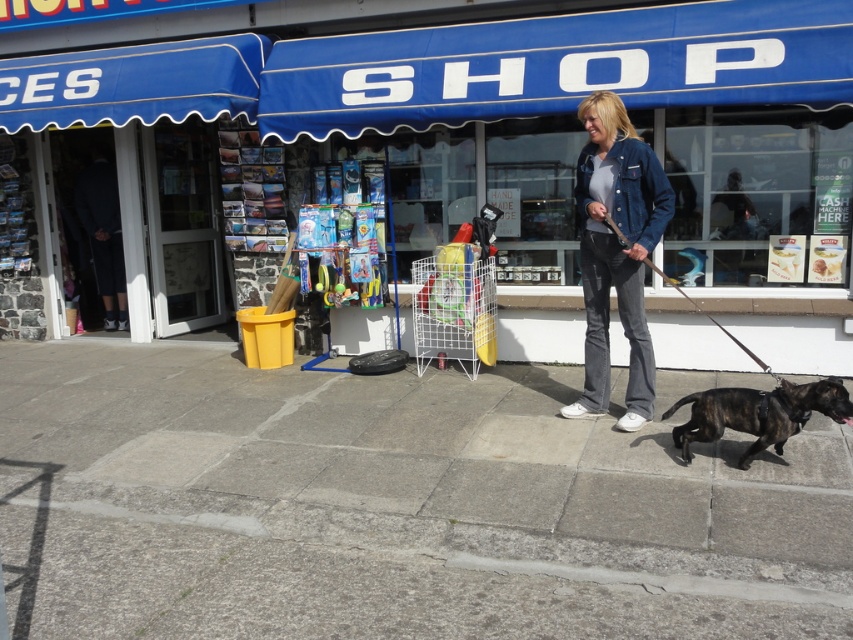
You are a delivery person who needs to place a box on the gray concrete pavement at lower center. The box is 3 meters tall. Will the box hit the blue fabric awning at upper center when placed?

The distance between the blue fabric awning at upper center and the gray concrete pavement at lower center is 3.20 meters. Since the box is only 3 meters tall, it will not reach the awning and will not hit it.

You are a delivery person standing at the entrance of the shop. You need to place a package that is 1.2 meters long on the ground. The package must be placed between the blue fabric awning at upper center and the brindle fur dog at lower right. Is there enough space between them to fit the package?

The blue fabric awning at upper center is 3.18 meters away from the brindle fur dog at lower right. Since the package is 1.2 meters long, there is sufficient space between them to accommodate the package.